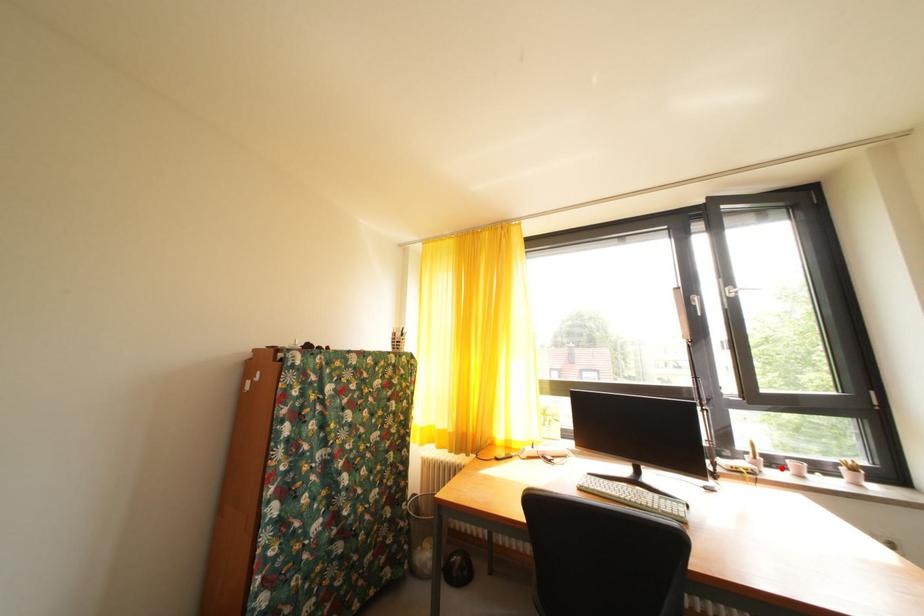
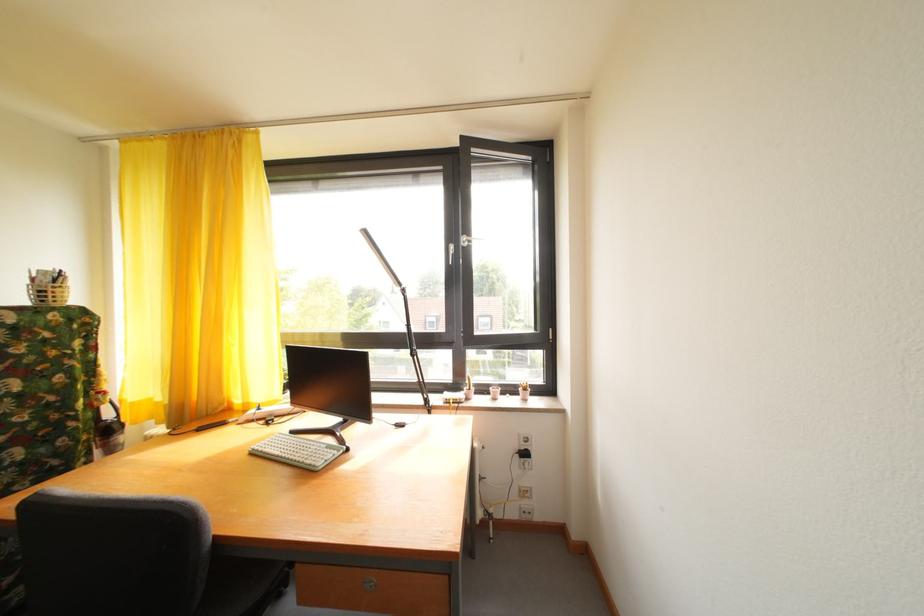
Locate, in the second image, the point that corresponds to the highlighted location in the first image.

(492, 395)